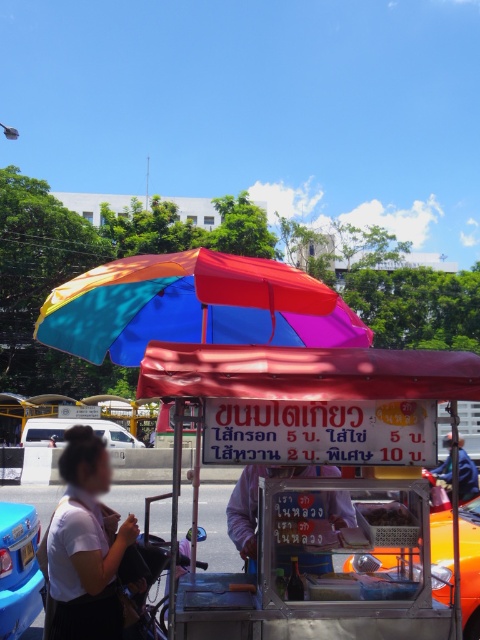
Based on the photo, you are standing in front of the food stall and want to take a photo of the two points mentioned. Which point, point (260, 465) or point (34, 561), will appear larger in your photo?

Point (260, 465) will appear larger in the photo because it is closer to the camera than point (34, 561).

You are a customer at the street food stall and want to place your order. You notice the metallic orange taxi at lower right and the metallic silver tray at center. Which object is closer to the ground?

The metallic orange taxi at lower right is below the metallic silver tray at center, so it is closer to the ground.

You are a customer at the street food stall and want to carry your purchase to the metallic orange taxi at lower right. The metallic silver tray at center is available for use. Considering their sizes, will the tray fit inside the taxi?

The metallic orange taxi at lower right is bigger than the metallic silver tray at center, so the tray will fit inside the taxi.